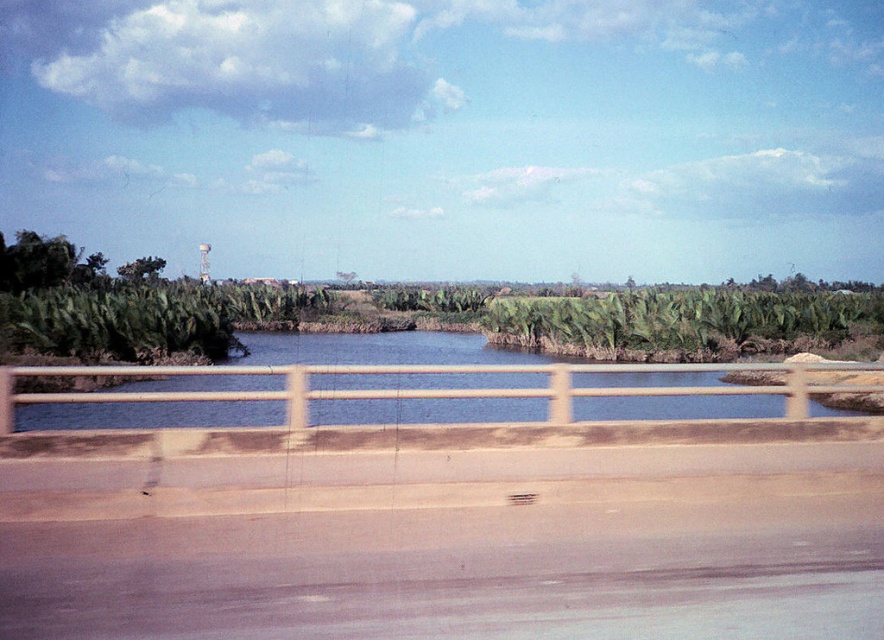
Is blue water at center bigger than green leafy tree at upper left?

Yes.

Does point (246, 401) come in front of point (151, 259)?

Yes.

In order to click on blue water at center in this screenshot , I will do click(377, 349).